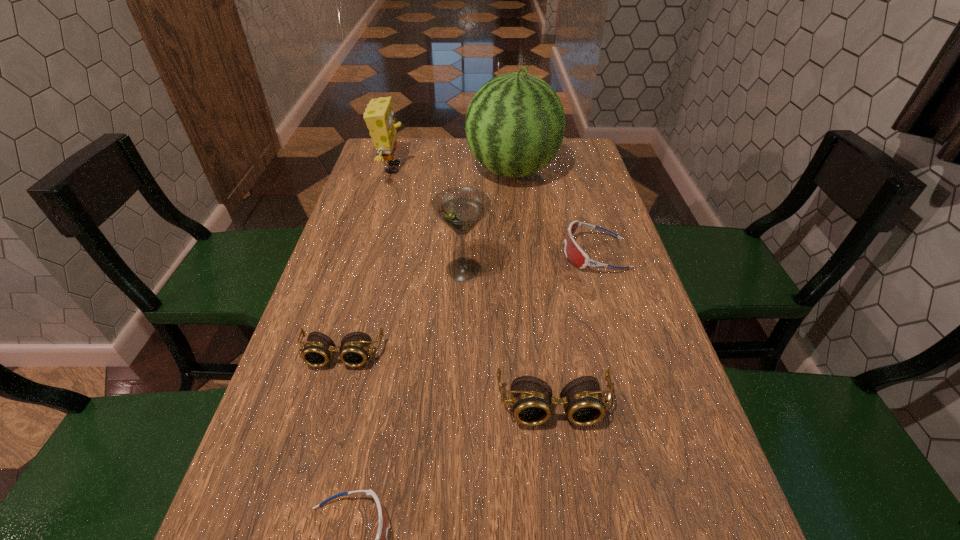
This screenshot has height=540, width=960. Find the location of `vacant area that lies between the fourth tallest object and the sponge`. vacant area that lies between the fourth tallest object and the sponge is located at coordinates (472, 287).

The height and width of the screenshot is (540, 960). Identify the location of vacant point located between the martini and the bigger red goggles. (529, 262).

Locate an element on the screen. The width and height of the screenshot is (960, 540). vacant point located between the martini and the bigger brown goggles is located at coordinates (509, 338).

Select which object appears as the fourth closest to the martini. Please provide its 2D coordinates. Your answer should be formatted as a tuple, i.e. [(x, y)], where the tuple contains the x and y coordinates of a point satisfying the conditions above.

[(515, 124)]

At what (x,y) coordinates should I click in order to perform the action: click on the sixth closest object relative to the nearest object. Please return your answer as a coordinate pair (x, y). The width and height of the screenshot is (960, 540). Looking at the image, I should click on (379, 117).

This screenshot has width=960, height=540. Identify the location of goggles that is the fourth nearest to the sponge. (384, 524).

Find the location of `goggles that stands as the third closest to the bigger brown goggles`. goggles that stands as the third closest to the bigger brown goggles is located at coordinates (573, 252).

I want to click on the second closest brown goggles to the yellow sponge, so 531,398.

Find the location of a particular element. The image size is (960, 540). free space that satisfies the following two spatial constraints: 1. on the face of the sponge; 2. on the left side of the green watermelon is located at coordinates (391, 171).

Where is `free space that satisfies the following two spatial constraints: 1. on the front-facing side of the right red goggles; 2. through the lenses of the fourth shortest object`? Image resolution: width=960 pixels, height=540 pixels. free space that satisfies the following two spatial constraints: 1. on the front-facing side of the right red goggles; 2. through the lenses of the fourth shortest object is located at coordinates (640, 407).